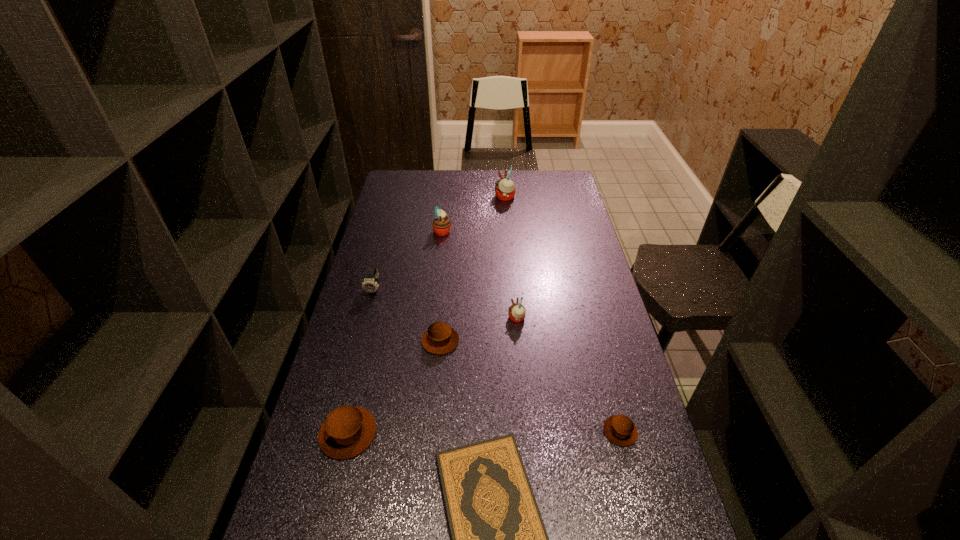
Identify the location of free space between the farthest muffin and the sixth nearest object. (440, 244).

In order to click on empty location between the third shortest object and the dark watch in this screenshot , I will do `click(407, 315)`.

The image size is (960, 540). I want to click on free space between the leftmost brown muffin and the rightmost brown muffin, so click(484, 433).

Choose which object is the fourth nearest neighbor to the leftmost muffin. Please provide its 2D coordinates. Your answer should be formatted as a tuple, i.e. [(x, y)], where the tuple contains the x and y coordinates of a point satisfying the conditions above.

[(516, 312)]

Find the location of a particular element. The image size is (960, 540). the fourth closest object to the rightmost muffin is located at coordinates (347, 431).

Identify which muffin is the fifth nearest to the tallest muffin. Please provide its 2D coordinates. Your answer should be formatted as a tuple, i.e. [(x, y)], where the tuple contains the x and y coordinates of a point satisfying the conditions above.

[(347, 431)]

Locate which muffin ranks second in proximity to the biggest brown muffin. Please provide its 2D coordinates. Your answer should be formatted as a tuple, i.e. [(x, y)], where the tuple contains the x and y coordinates of a point satisfying the conditions above.

[(516, 312)]

Locate an element on the screen. Image resolution: width=960 pixels, height=540 pixels. the closest pink muffin to the second farthest pink muffin is located at coordinates (505, 189).

Identify the location of the second closest pink muffin to the leftmost muffin. Image resolution: width=960 pixels, height=540 pixels. (441, 225).

The image size is (960, 540). What are the coordinates of `brown muffin that is the third nearest to the watch` in the screenshot? It's located at (619, 429).